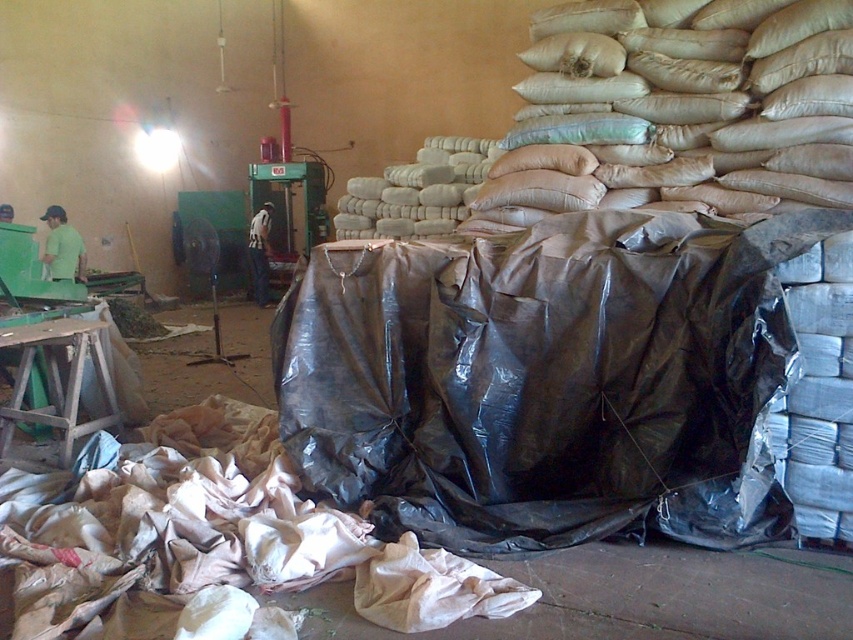
Question: Is green matte shirt at left above white striped shirt at center?

Choices:
 (A) yes
 (B) no

Answer: (B)

Question: Which point is farther to the camera?

Choices:
 (A) (67, 269)
 (B) (128, 564)

Answer: (A)

Question: Which object is farther from the camera taking this photo?

Choices:
 (A) beige fabric sack at lower left
 (B) white striped shirt at center

Answer: (B)

Question: Is green matte shirt at left smaller than white striped shirt at center?

Choices:
 (A) no
 (B) yes

Answer: (A)

Question: Which point is farther to the camera?

Choices:
 (A) (260, 230)
 (B) (57, 621)

Answer: (A)

Question: In this image, where is beige fabric sack at lower left located relative to white striped shirt at center?

Choices:
 (A) above
 (B) below

Answer: (B)